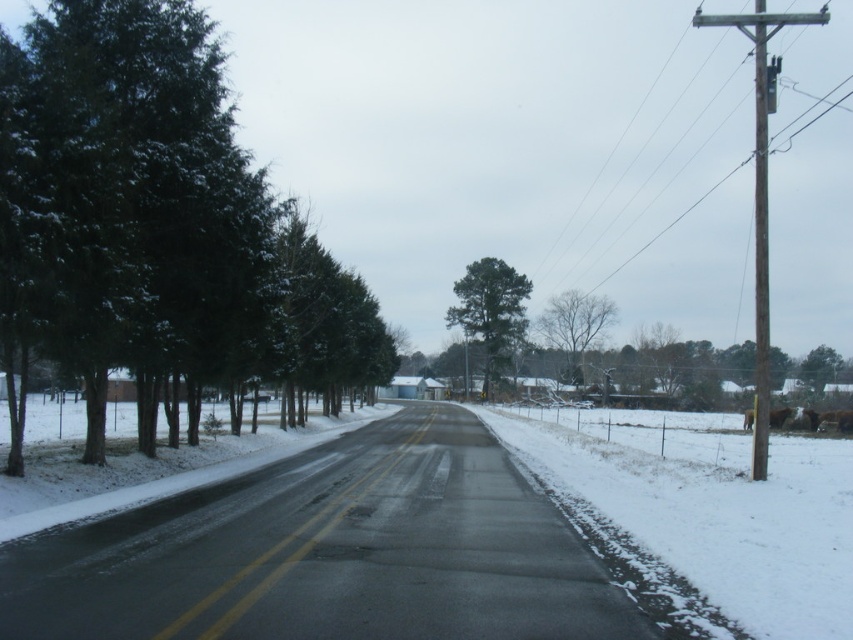
You are standing at the point marked as point (461, 288) on the rural road. You want to take a photo of the entire scene from your current position. Considering the distance between you and the camera, will the camera be able to capture the entire scene in one shot?

The distance between point (461, 288) and the camera is 97.84 meters. Since the camera is positioned 97.84 meters away from your location, it might struggle to capture the entire scene in one shot due to the significant distance, especially if the camera has a limited zoom range or field of view.

You are driving a car and see the green matte trees at left and the brown wooden telegraph pole at right from the road. Which object is closer to the left side of the road?

The green matte trees at left are closer to the left side of the road since they are positioned to the left of the brown wooden telegraph pole at right.

You are driving a car with a 4.5 meter turning radius. You need to make a U turn on the road in this scene. The green matte trees at left are in your way. Can you make the U turn without hitting them?

The distance between the green matte trees at left and the camera is 11.94 meters. Since your car requires a 4.5 meter turning radius, you have enough space to make the U turn without hitting the trees as 11.94 meters is greater than 4.5 meters.